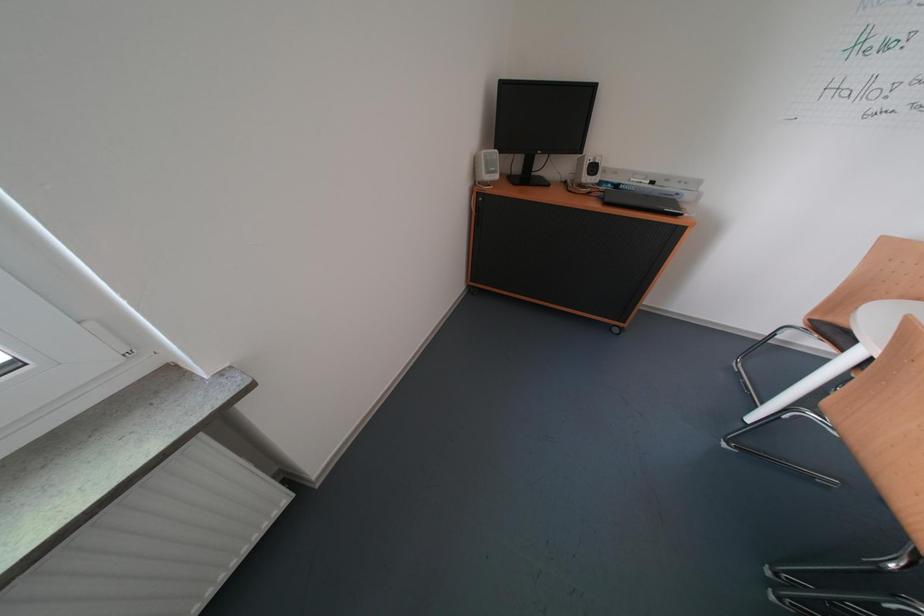
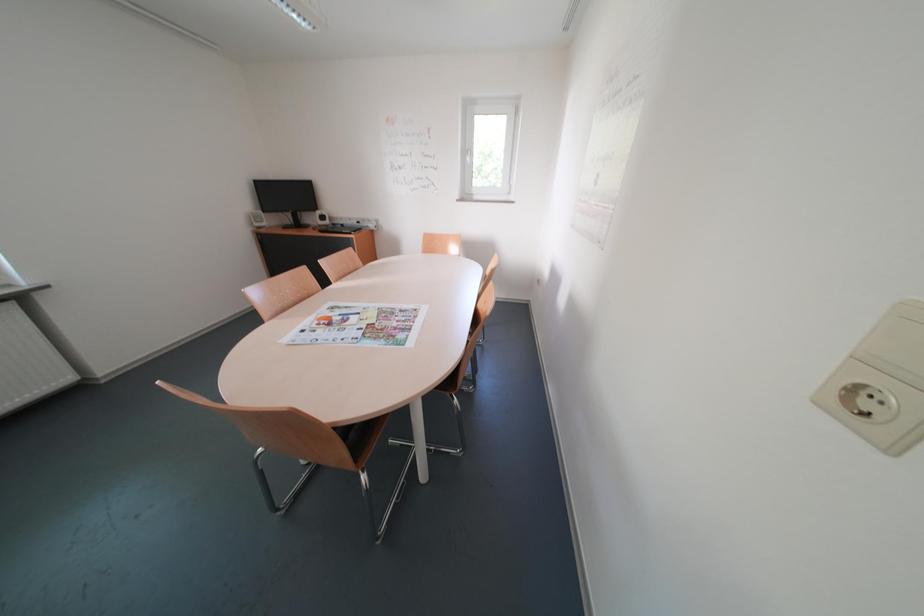
In a continuous first-person perspective shot, in which direction is the camera moving?

The cameraman walked toward right, backward.